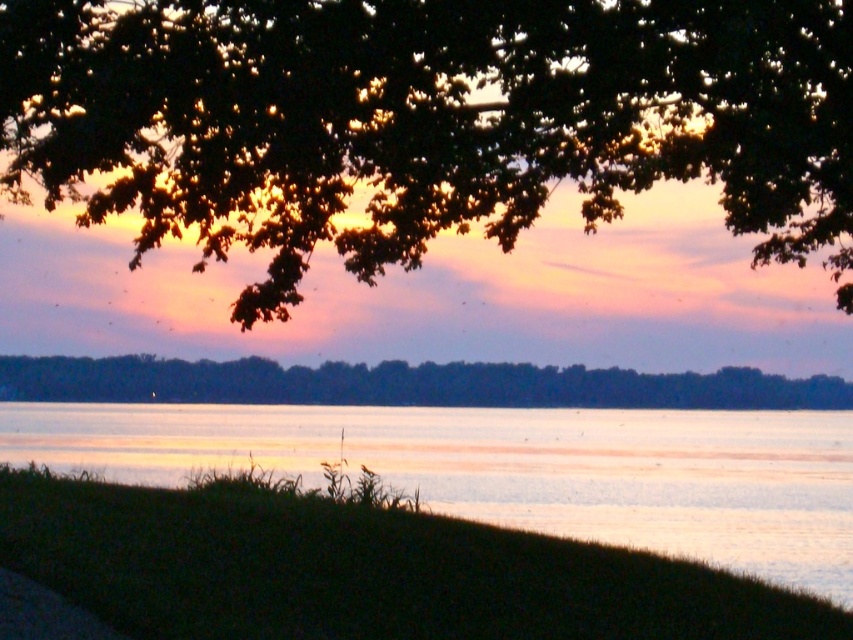
Question: Is green leafy tree at upper center bigger than silvery reflective water at lower center?

Choices:
 (A) no
 (B) yes

Answer: (B)

Question: Is green leafy tree at upper center positioned before silvery reflective water at lower center?

Choices:
 (A) yes
 (B) no

Answer: (A)

Question: Estimate the real-world distances between objects in this image. Which object is closer to the dark green leafy trees at center?

Choices:
 (A) green leafy tree at upper center
 (B) silvery reflective water at lower center

Answer: (B)

Question: Which object appears closest to the camera in this image?

Choices:
 (A) green leafy tree at upper center
 (B) dark green leafy trees at center
 (C) silvery reflective water at lower center

Answer: (A)

Question: Does silvery reflective water at lower center have a larger size compared to dark green leafy trees at center?

Choices:
 (A) yes
 (B) no

Answer: (A)

Question: Which object is the farthest from the green leafy tree at upper center?

Choices:
 (A) dark green leafy trees at center
 (B) silvery reflective water at lower center

Answer: (A)